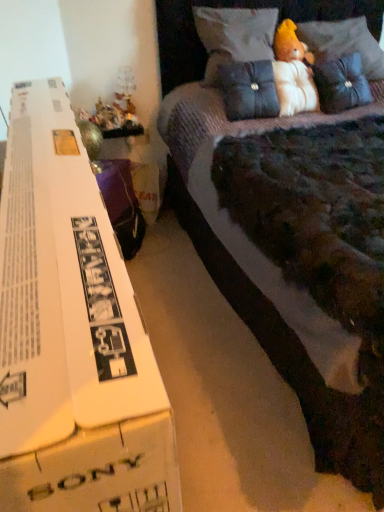
Question: Considering the relative positions of velvet dark blue pillow at upper right, the first pillow when ordered from right to left, and fluffy white teddy bear at upper right, which is counted as the first toy, starting from the right, in the image provided, is velvet dark blue pillow at upper right, the first pillow when ordered from right to left, in front of fluffy white teddy bear at upper right, which is counted as the first toy, starting from the right,?

Choices:
 (A) yes
 (B) no

Answer: (A)

Question: Is fluffy white teddy bear at upper right, the second toy viewed from the left, inside velvet dark blue pillow at upper right, the third pillow positioned from the left?

Choices:
 (A) no
 (B) yes

Answer: (A)

Question: Can you confirm if velvet dark blue pillow at upper right, the third pillow positioned from the left, is taller than fluffy white teddy bear at upper right, marked as the 2th toy in a bottom-to-top arrangement?

Choices:
 (A) yes
 (B) no

Answer: (A)

Question: Can you confirm if velvet dark blue pillow at upper right, the first pillow when ordered from right to left, is positioned to the left of fluffy white teddy bear at upper right, the 1th toy when ordered from top to bottom?

Choices:
 (A) no
 (B) yes

Answer: (A)

Question: From the image's perspective, would you say velvet dark blue pillow at upper right, the third pillow positioned from the left, is positioned over fluffy white teddy bear at upper right, marked as the 2th toy in a bottom-to-top arrangement?

Choices:
 (A) yes
 (B) no

Answer: (B)

Question: From a real-world perspective, is velvet purple bed at center physically located above or below white cardboard box at left?

Choices:
 (A) above
 (B) below

Answer: (A)

Question: Looking at the image, does velvet purple bed at center seem bigger or smaller compared to white cardboard box at left?

Choices:
 (A) small
 (B) big

Answer: (B)

Question: In terms of width, does velvet purple bed at center look wider or thinner when compared to white cardboard box at left?

Choices:
 (A) wide
 (B) thin

Answer: (A)

Question: Considering the relative positions of velvet purple bed at center and white cardboard box at left in the image provided, is velvet purple bed at center to the left or to the right of white cardboard box at left?

Choices:
 (A) right
 (B) left

Answer: (A)

Question: Looking at their shapes, would you say velvet blue pillow at upper center, the third pillow viewed from the right, is wider or thinner than white cardboard box at left?

Choices:
 (A) thin
 (B) wide

Answer: (B)

Question: From a real-world perspective, is velvet blue pillow at upper center, the 1th pillow in the left-to-right sequence, above or below white cardboard box at left?

Choices:
 (A) above
 (B) below

Answer: (A)

Question: In terms of size, does velvet blue pillow at upper center, the 1th pillow in the left-to-right sequence, appear bigger or smaller than white cardboard box at left?

Choices:
 (A) small
 (B) big

Answer: (A)

Question: In the image, is velvet blue pillow at upper center, the third pillow viewed from the right, on the left side or the right side of white cardboard box at left?

Choices:
 (A) right
 (B) left

Answer: (A)

Question: Is velvet purple bed at center in front of or behind velvet blue pillow at upper center, the third pillow viewed from the right, in the image?

Choices:
 (A) front
 (B) behind

Answer: (A)

Question: Based on their sizes in the image, would you say velvet purple bed at center is bigger or smaller than velvet blue pillow at upper center, the 1th pillow in the left-to-right sequence?

Choices:
 (A) small
 (B) big

Answer: (B)